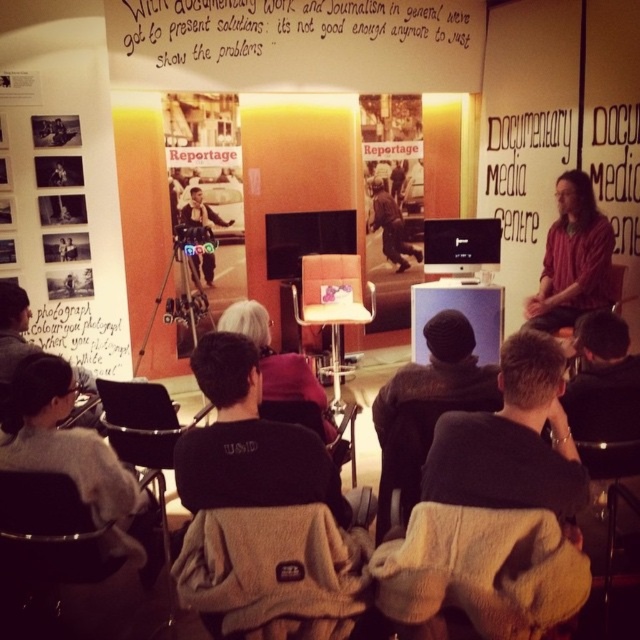
Is black fleece jacket at center thinner than matte black monitor at center?

Yes.

Does black fleece jacket at center have a greater width compared to matte black monitor at center?

No.

Is point (308, 458) less distant than point (324, 214)?

Yes, point (308, 458) is closer to viewer.

Find the location of a particular element. black fleece jacket at center is located at coordinates 250,442.

Does black fleece jacket at center appear on the right side of wooden textured chair at lower right?

No, black fleece jacket at center is not to the right of wooden textured chair at lower right.

Is black fleece jacket at center below wooden textured chair at lower right?

Actually, black fleece jacket at center is above wooden textured chair at lower right.

Between point (321, 481) and point (616, 448), which one is positioned behind?

Point (616, 448)

Locate an element on the screen. Image resolution: width=640 pixels, height=640 pixels. black fleece jacket at center is located at coordinates (250, 442).

Does dark brown sweater at center lie in front of velvet beige chair at lower left?

Yes, it is in front of velvet beige chair at lower left.

Between dark brown sweater at center and velvet beige chair at lower left, which one has more height?

Standing taller between the two is dark brown sweater at center.

Identify the location of dark brown sweater at center. (513, 442).